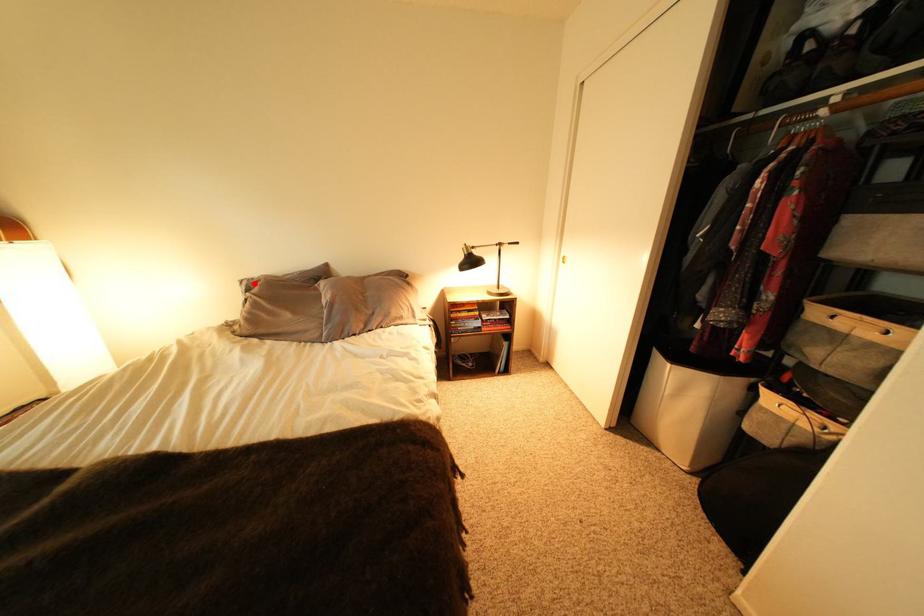
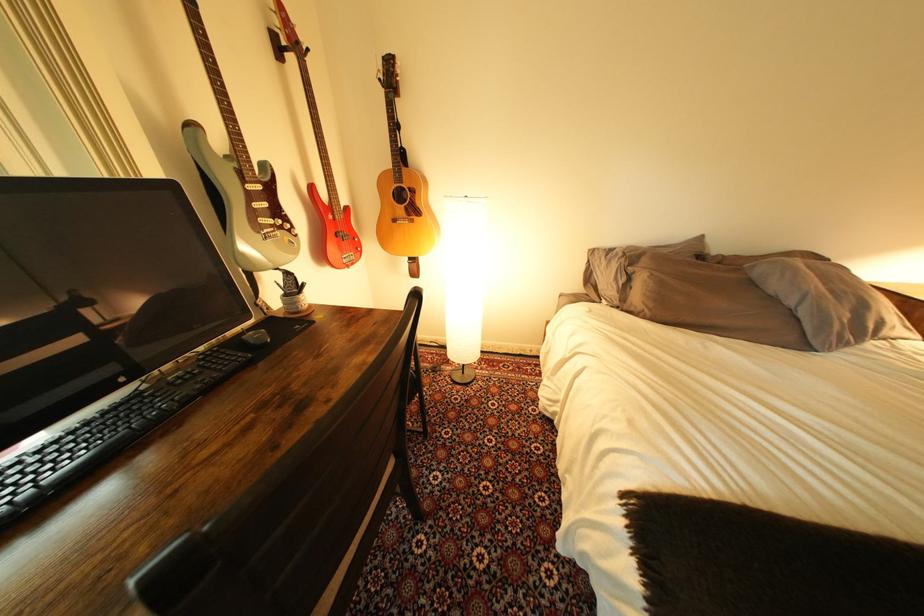
Question: I am providing you with two images of the same scene from different viewpoints. Given a red point in image1, look at the same physical point in image2. Is it:

Choices:
 (A) Closer to the viewpoint
 (B) Farther from the viewpoint

Answer: (A)